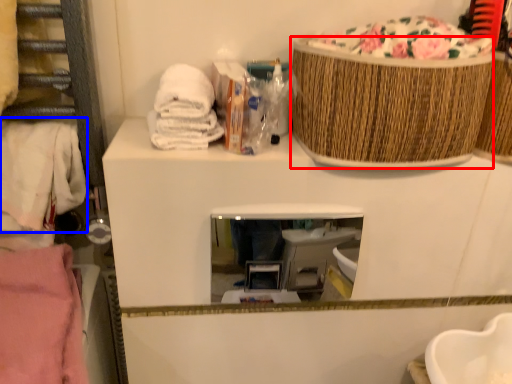
Question: Among these objects, which one is nearest to the camera, basket (highlighted by a red box) or clothing (highlighted by a blue box)?

Choices:
 (A) basket
 (B) clothing

Answer: (A)